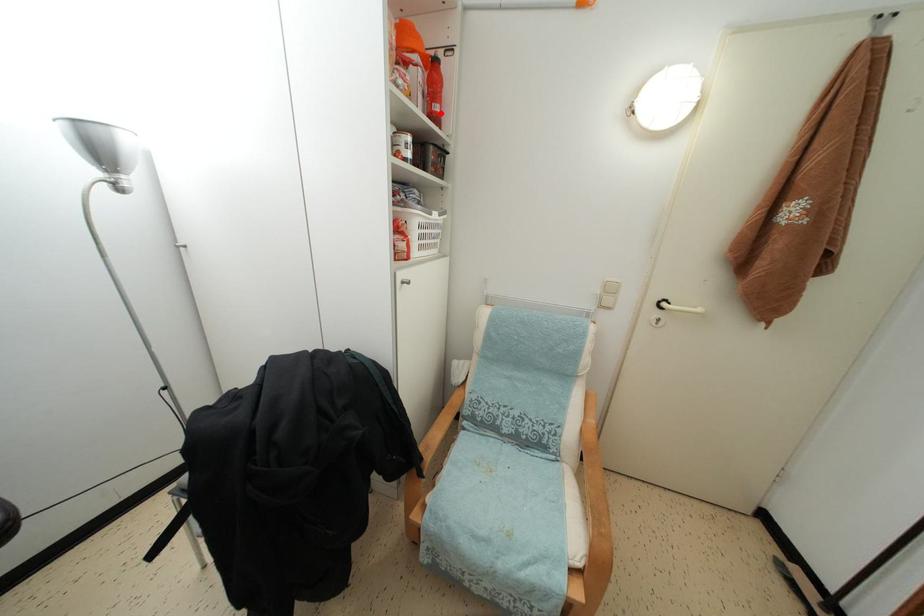
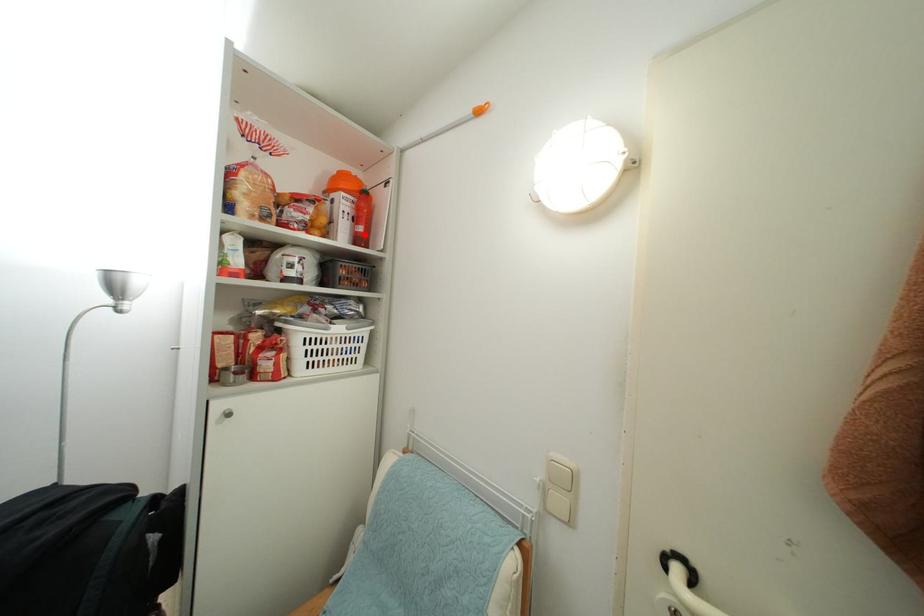
I am providing you with two images of the same scene from different viewpoints. A red point is marked on the first image and another point is marked on the second image. Does the point marked in image1 correspond to the same location as the one in image2?

Yes